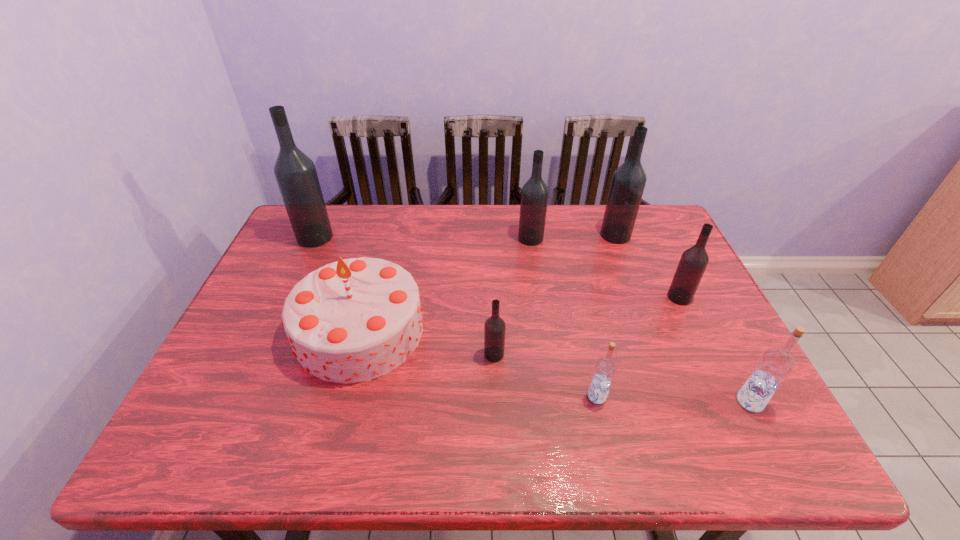
The image size is (960, 540). I want to click on the leftmost vodka, so (295, 173).

I want to click on the leftmost object, so click(x=295, y=173).

The width and height of the screenshot is (960, 540). I want to click on the third object from right to left, so pyautogui.click(x=628, y=182).

Image resolution: width=960 pixels, height=540 pixels. I want to click on the sixth shortest vodka, so click(x=628, y=182).

This screenshot has height=540, width=960. I want to click on the fifth object from right to left, so click(534, 195).

Where is `the third tallest object`? Image resolution: width=960 pixels, height=540 pixels. the third tallest object is located at coordinates (534, 195).

Where is `the second object from left to right`? The width and height of the screenshot is (960, 540). the second object from left to right is located at coordinates (353, 320).

Identify the location of the rightmost black vodka. (693, 262).

Find the location of `the fourth nearest vodka`. the fourth nearest vodka is located at coordinates (693, 262).

Find the location of a particular element. the right blue vodka is located at coordinates pos(775,365).